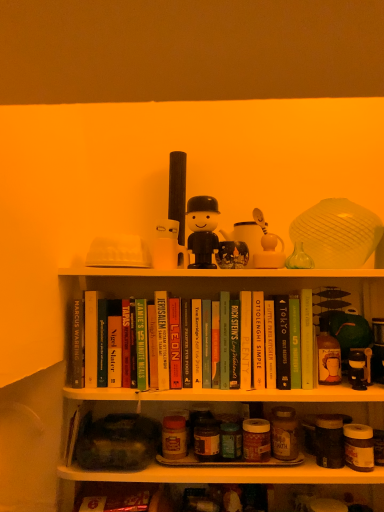
The image size is (384, 512). Identify the location of free location in front of hardcover book at center, the 5th paperback book viewed from the left. (169, 388).